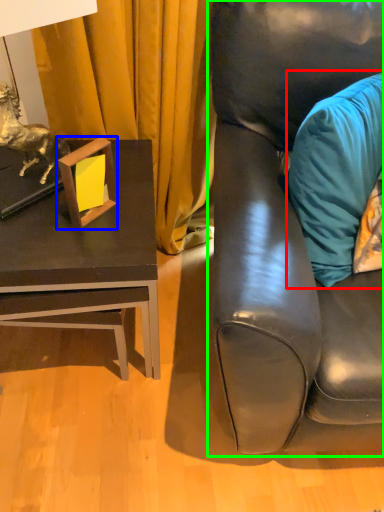
Question: Based on their relative distances, which object is farther from pillow (highlighted by a red box)? Choose from picture frame (highlighted by a blue box) and studio couch (highlighted by a green box).

Choices:
 (A) picture frame
 (B) studio couch

Answer: (A)